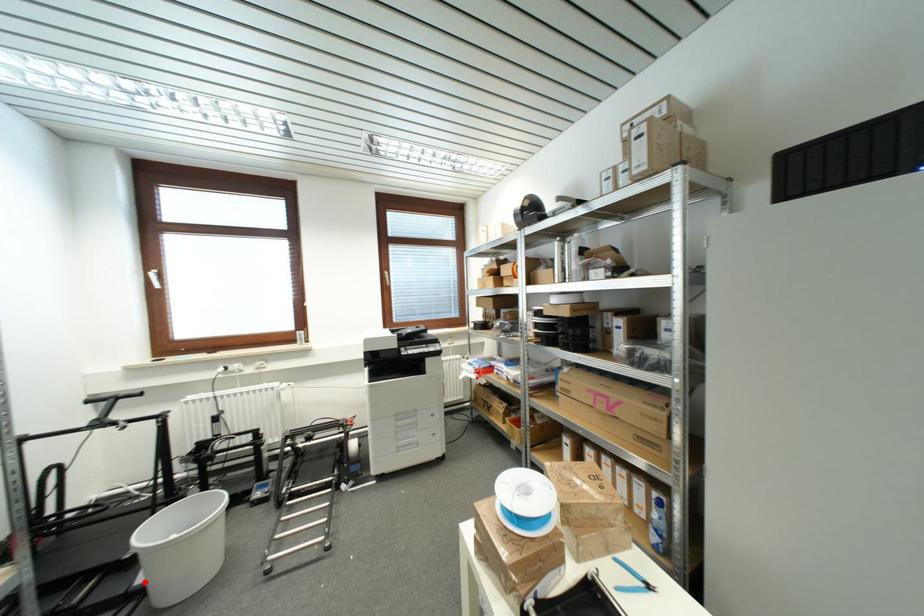
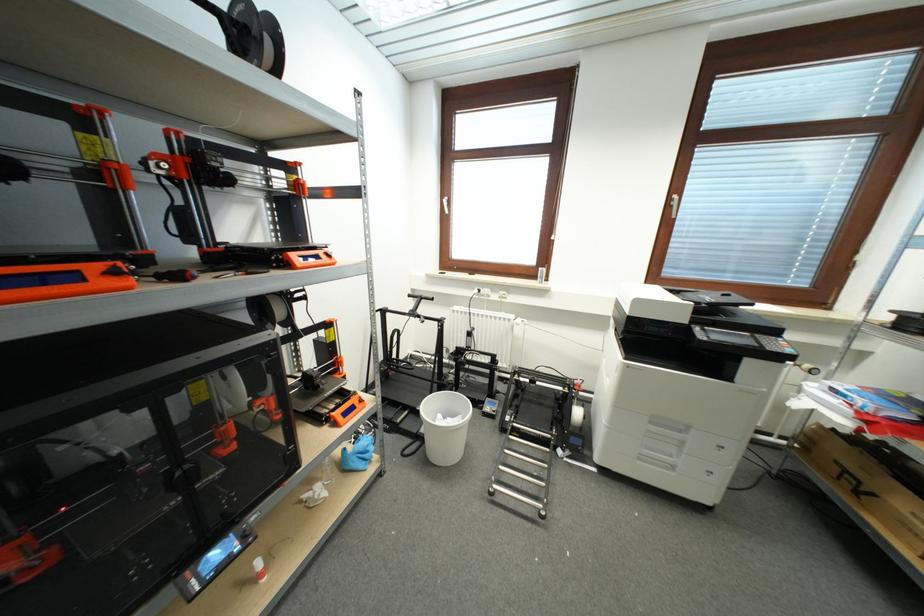
Where in the second image is the point corresponding to the highlighted location from the first image?

(427, 434)